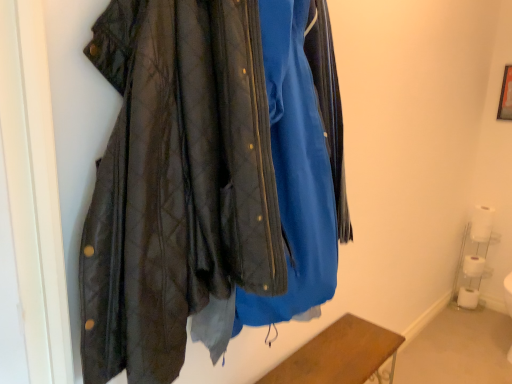
Question: Could you tell me if white paper towel at lower right, arranged as the second toilet paper when viewed from the top, is turned towards white plastic shelf at lower right?

Choices:
 (A) yes
 (B) no

Answer: (B)

Question: Is white paper towel at lower right, which is the 3th toilet paper in bottom-to-top order, not close to white plastic shelf at lower right?

Choices:
 (A) yes
 (B) no

Answer: (B)

Question: Considering the relative sizes of white paper towel at lower right, which is the 3th toilet paper in bottom-to-top order, and white plastic shelf at lower right in the image provided, is white paper towel at lower right, which is the 3th toilet paper in bottom-to-top order, thinner than white plastic shelf at lower right?

Choices:
 (A) no
 (B) yes

Answer: (B)

Question: From the image's perspective, does white paper towel at lower right, which is the 3th toilet paper in bottom-to-top order, appear higher than white plastic shelf at lower right?

Choices:
 (A) yes
 (B) no

Answer: (A)

Question: From a real-world perspective, does white paper towel at lower right, arranged as the second toilet paper when viewed from the top, stand above white plastic shelf at lower right?

Choices:
 (A) no
 (B) yes

Answer: (B)

Question: Is white paper towel at lower right, arranged as the second toilet paper when viewed from the top, touching white plastic shelf at lower right?

Choices:
 (A) yes
 (B) no

Answer: (B)

Question: Is white matte toilet paper at lower right, the fourth toilet paper positioned from the bottom, smaller than white matte toilet paper at lower right, the fourth toilet paper in the top-to-bottom sequence?

Choices:
 (A) yes
 (B) no

Answer: (B)

Question: Can you confirm if white matte toilet paper at lower right, the fourth toilet paper positioned from the bottom, is bigger than white matte toilet paper at lower right, positioned as the 1th toilet paper in bottom-to-top order?

Choices:
 (A) yes
 (B) no

Answer: (A)

Question: Is the depth of white matte toilet paper at lower right, the fourth toilet paper positioned from the bottom, less than that of white matte toilet paper at lower right, the fourth toilet paper in the top-to-bottom sequence?

Choices:
 (A) yes
 (B) no

Answer: (A)

Question: Is white matte toilet paper at lower right, the fourth toilet paper positioned from the bottom, shorter than white matte toilet paper at lower right, positioned as the 1th toilet paper in bottom-to-top order?

Choices:
 (A) yes
 (B) no

Answer: (A)

Question: Can you see white matte toilet paper at lower right, which appears as the 1th toilet paper when viewed from the top, touching white matte toilet paper at lower right, the fourth toilet paper in the top-to-bottom sequence?

Choices:
 (A) yes
 (B) no

Answer: (B)

Question: Considering the relative sizes of white matte toilet paper at lower right, the fourth toilet paper positioned from the bottom, and white matte toilet paper at lower right, positioned as the 1th toilet paper in bottom-to-top order, in the image provided, is white matte toilet paper at lower right, the fourth toilet paper positioned from the bottom, wider than white matte toilet paper at lower right, positioned as the 1th toilet paper in bottom-to-top order,?

Choices:
 (A) yes
 (B) no

Answer: (B)

Question: Is white matte toilet paper at lower right, which is counted as the 3th toilet paper, starting from the top, closer to camera compared to white matte toilet paper at lower right, the fourth toilet paper in the top-to-bottom sequence?

Choices:
 (A) yes
 (B) no

Answer: (A)